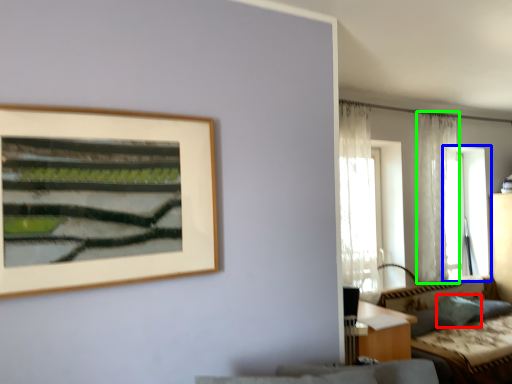
Question: Based on their relative distances, which object is farther from pillow (highlighted by a red box)? Choose from window (highlighted by a blue box) and curtain (highlighted by a green box).

Choices:
 (A) window
 (B) curtain

Answer: (A)